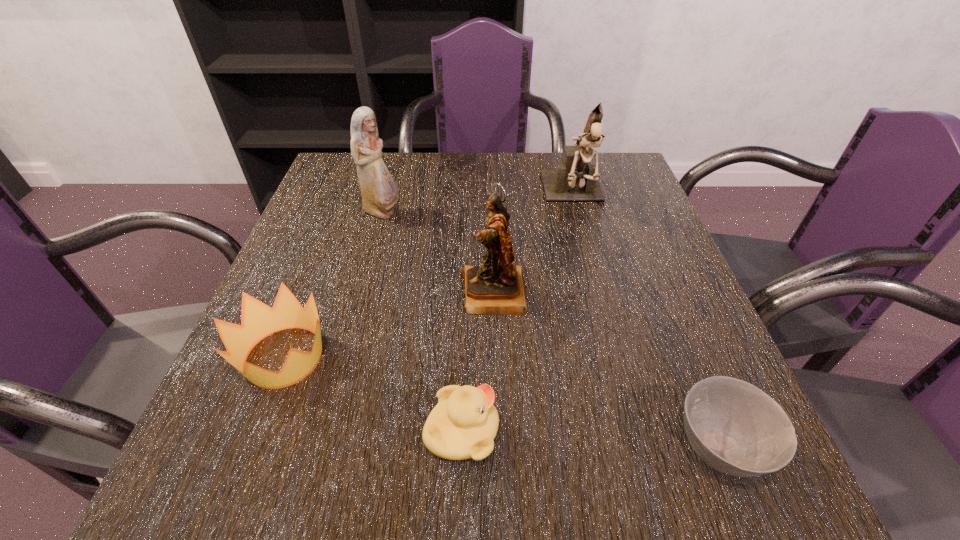
You are a GUI agent. You are given a task and a screenshot of the screen. Output one action in this format:
    pyautogui.click(x=<x>, y=<y>)
    Task: Click on the object present at the far right corner
    The height and width of the screenshot is (540, 960).
    Given the screenshot: What is the action you would take?
    pyautogui.click(x=574, y=180)

I want to click on object located in the near right corner section of the desktop, so click(x=734, y=427).

Locate an element on the screen. free region at the far edge of the desktop is located at coordinates (463, 193).

In the image, there is a desktop. Identify the location of free space at the near edge. (342, 480).

Where is `vacant space at the left edge`? vacant space at the left edge is located at coordinates (359, 244).

Where is `free space at the right edge`? The height and width of the screenshot is (540, 960). free space at the right edge is located at coordinates (653, 211).

Identify the location of vacant space at the far left corner of the desktop. This screenshot has width=960, height=540. point(329,198).

The height and width of the screenshot is (540, 960). Identify the location of free location at the far right corner of the desktop. (599, 156).

At what (x,y) coordinates should I click in order to perform the action: click on vacant region between the leftmost figurine and the rightmost figurine. Please return your answer as a coordinate pair (x, y). The height and width of the screenshot is (540, 960). Looking at the image, I should click on (478, 205).

Locate an element on the screen. Image resolution: width=960 pixels, height=540 pixels. vacant point located between the rightmost figurine and the nearest figurine is located at coordinates (534, 245).